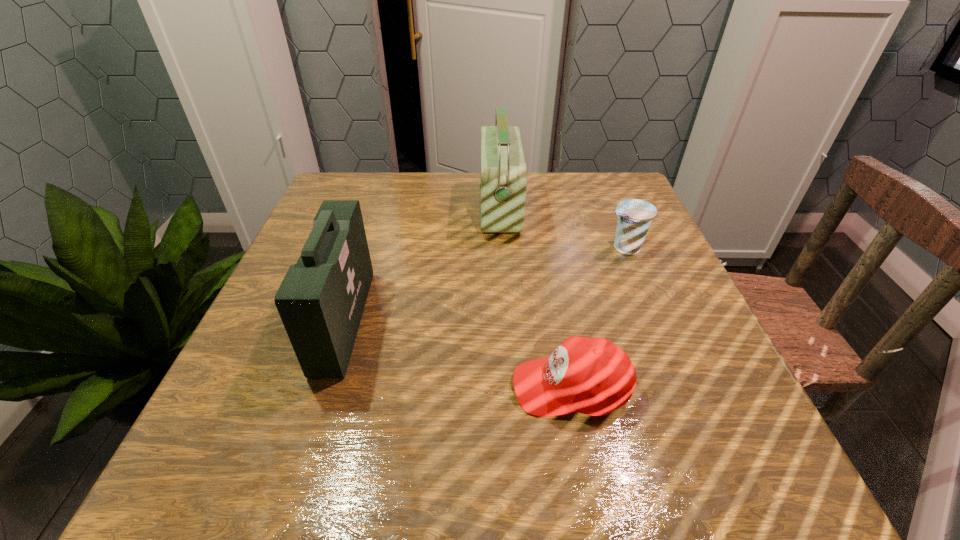
Choose which object is the second nearest neighbor to the yogurt. Please provide its 2D coordinates. Your answer should be formatted as a tuple, i.e. [(x, y)], where the tuple contains the x and y coordinates of a point satisfying the conditions above.

[(593, 376)]

Find the location of a particular element. The width and height of the screenshot is (960, 540). object that is the closest one to the leftmost object is located at coordinates (503, 183).

Where is `vacant position in the image that satisfies the following two spatial constraints: 1. on the front side of the rightmost object; 2. on the front-facing side of the leftmost object`? This screenshot has width=960, height=540. vacant position in the image that satisfies the following two spatial constraints: 1. on the front side of the rightmost object; 2. on the front-facing side of the leftmost object is located at coordinates (655, 321).